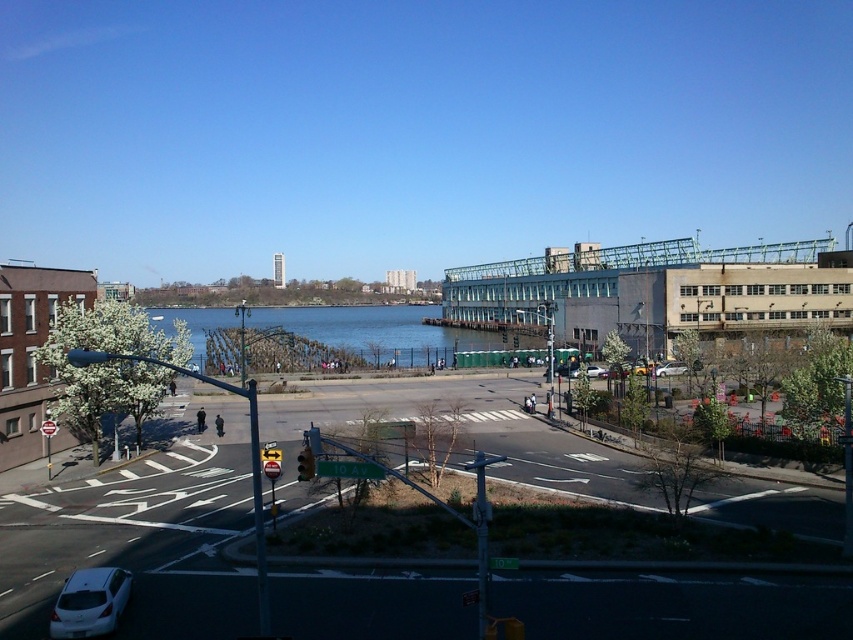
You are a pedestrian standing at the crosswalk on the 10 Ave intersection. You see two metallic silver sedans at the center. The first one is matte silver sedan at center and the second one is metallic silver sedan at center. Can you safely walk between them if your walking path is 1.2 meters wide?

The distance between the matte silver sedan at center and the metallic silver sedan at center is 3.65 meters. Since the walking path required is 1.2 meters, there is enough space for you to walk safely between them.